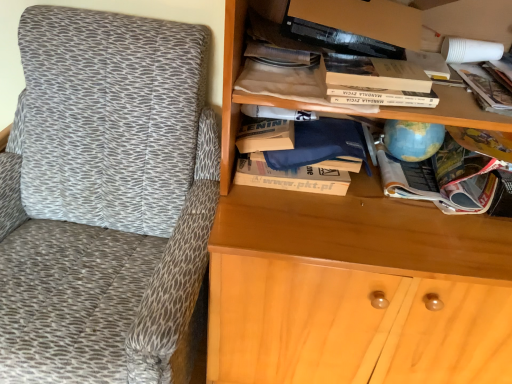
Question: Is hardcover book at upper center at the left side of wooden bookshelf at upper right?

Choices:
 (A) no
 (B) yes

Answer: (A)

Question: Does hardcover book at upper center lie in front of wooden bookshelf at upper right?

Choices:
 (A) no
 (B) yes

Answer: (A)

Question: Considering the relative sizes of hardcover book at upper center and wooden bookshelf at upper right in the image provided, is hardcover book at upper center smaller than wooden bookshelf at upper right?

Choices:
 (A) yes
 (B) no

Answer: (A)

Question: Is hardcover book at upper center facing away from wooden bookshelf at upper right?

Choices:
 (A) no
 (B) yes

Answer: (B)

Question: From a real-world perspective, is hardcover book at upper center on wooden bookshelf at upper right?

Choices:
 (A) yes
 (B) no

Answer: (B)

Question: Does hardcover book at upper center have a lesser height compared to wooden bookshelf at upper right?

Choices:
 (A) yes
 (B) no

Answer: (A)

Question: Would you say wooden bookshelf at upper right is a long distance from textured fabric chair at left?

Choices:
 (A) no
 (B) yes

Answer: (A)

Question: Does wooden bookshelf at upper right have a greater height compared to textured fabric chair at left?

Choices:
 (A) yes
 (B) no

Answer: (B)

Question: From a real-world perspective, is wooden bookshelf at upper right positioned under textured fabric chair at left based on gravity?

Choices:
 (A) no
 (B) yes

Answer: (A)

Question: Can you confirm if wooden bookshelf at upper right is thinner than textured fabric chair at left?

Choices:
 (A) no
 (B) yes

Answer: (B)

Question: Is wooden bookshelf at upper right shorter than textured fabric chair at left?

Choices:
 (A) yes
 (B) no

Answer: (A)

Question: Considering the relative positions of wooden bookshelf at upper right and textured fabric chair at left in the image provided, is wooden bookshelf at upper right to the right of textured fabric chair at left from the viewer's perspective?

Choices:
 (A) yes
 (B) no

Answer: (A)

Question: Is multicolored paper magazine at center right, which appears as the 1th book when viewed from the right, outside hardcover book at upper center?

Choices:
 (A) yes
 (B) no

Answer: (A)